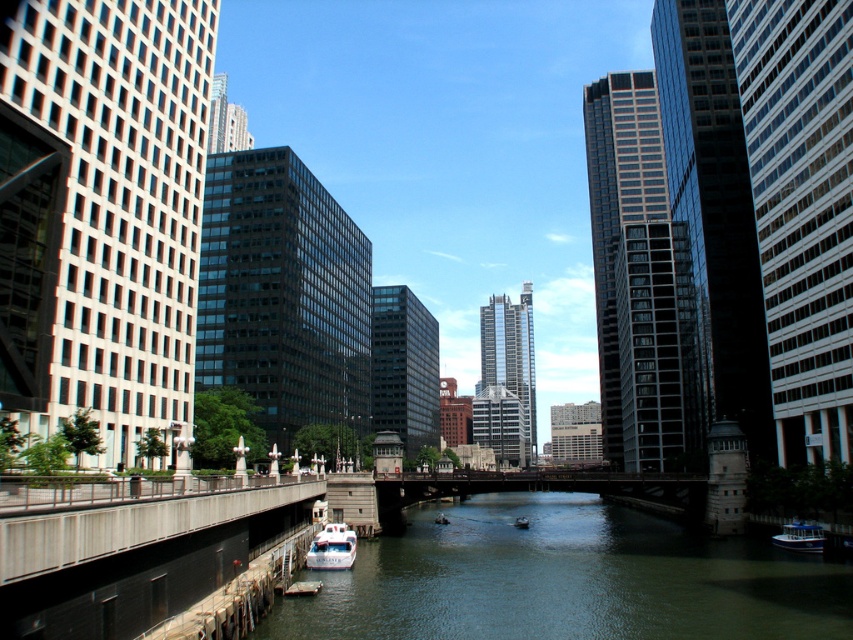
Question: Which object is the closest to the white plastic boat at center?

Choices:
 (A) white glossy boat at lower center
 (B) white glossy boat at lower right

Answer: (A)

Question: Is white glossy boat at lower center further to camera compared to white glossy boat at lower right?

Choices:
 (A) no
 (B) yes

Answer: (A)

Question: Does greenish water at center have a smaller size compared to white glossy boat at lower right?

Choices:
 (A) yes
 (B) no

Answer: (B)

Question: Considering the real-world distances, which object is farthest from the white plastic boat at center?

Choices:
 (A) greenish water at center
 (B) white glossy boat at lower center

Answer: (B)

Question: Which object is the closest to the greenish water at center?

Choices:
 (A) white plastic boat at center
 (B) white glossy boat at lower center

Answer: (B)

Question: Does greenish water at center have a larger size compared to white glossy boat at lower center?

Choices:
 (A) yes
 (B) no

Answer: (A)